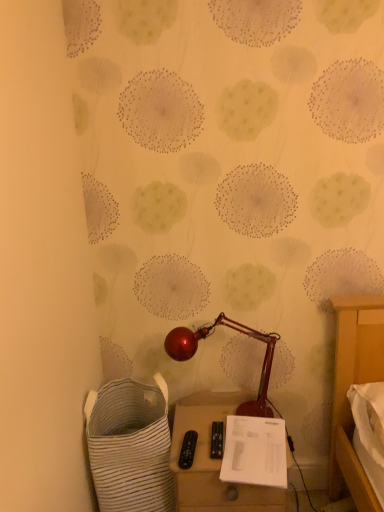
Identify the location of free space above matte beige side table at lower center (from a real-world perspective). (229, 434).